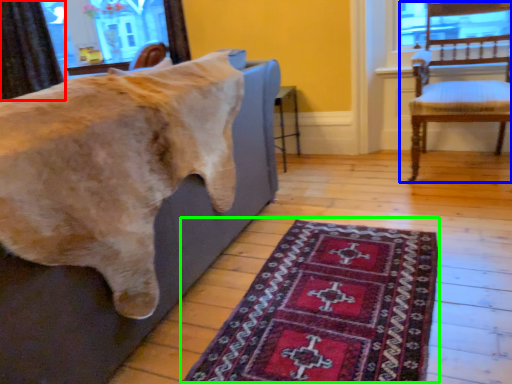
Question: Which is farther away from curtain (highlighted by a red box)? chair (highlighted by a blue box) or mat (highlighted by a green box)?

Choices:
 (A) chair
 (B) mat

Answer: (B)